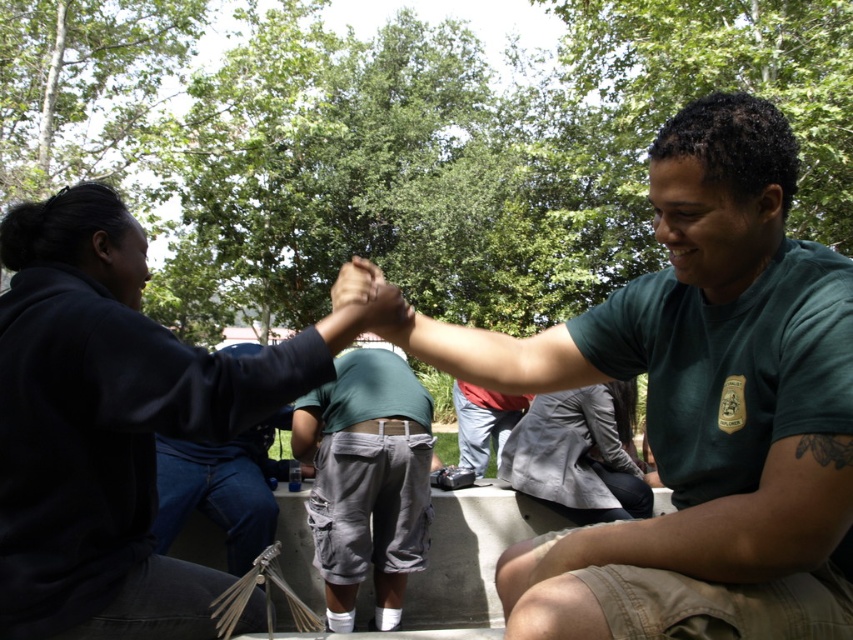
You are a photographer trying to capture a closeup shot of both the green uniform at center and the gray cotton cargo shorts at center. Since you want to ensure both are in focus, you need to know which one is wider. Can you tell me which is wider?

The green uniform at center might be wider than gray cotton cargo shorts at center, so you should focus on the green uniform at center first as it covers more area.

Looking at this image, you are standing in the scene and want to hand a note to the person wearing the gray cotton cargo shorts at center. To reach them, you must pass by the dark blue fabric shirt at upper left. Is the path clear to approach directly?

The dark blue fabric shirt at upper left is in front of gray cotton cargo shorts at center, so you cannot approach directly without moving around the dark blue fabric shirt at upper left first.